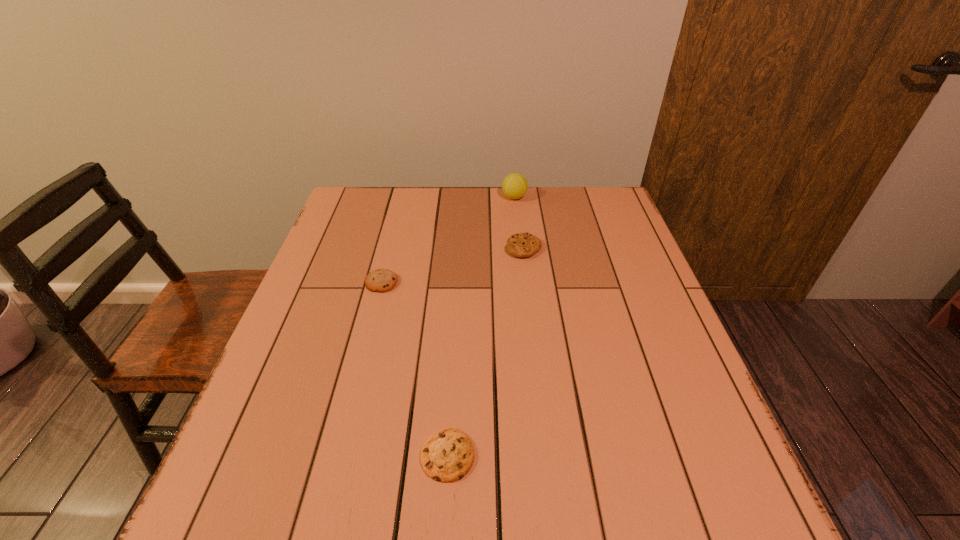
Where is `the farthest object`? This screenshot has width=960, height=540. the farthest object is located at coordinates (514, 186).

I want to click on the tallest object, so click(514, 186).

I want to click on the second farthest object, so click(x=521, y=245).

The width and height of the screenshot is (960, 540). Identify the location of the tallest cookie. (521, 245).

This screenshot has width=960, height=540. In order to click on the leftmost object in this screenshot , I will do `click(381, 280)`.

Locate an element on the screen. The height and width of the screenshot is (540, 960). the second shortest cookie is located at coordinates (381, 280).

At what (x,y) coordinates should I click in order to perform the action: click on the nearest cookie. Please return your answer as a coordinate pair (x, y). Looking at the image, I should click on (446, 456).

Where is `the nearest object`? This screenshot has width=960, height=540. the nearest object is located at coordinates (446, 456).

You are a GUI agent. You are given a task and a screenshot of the screen. Output one action in this format:
    pyautogui.click(x=<x>, y=<y>)
    Task: Click on the vacant area situated 0.260m on the front of the farthest object
    
    Given the screenshot: What is the action you would take?
    pyautogui.click(x=520, y=254)

I want to click on vacant area situated 0.370m on the left of the third nearest object, so click(373, 248).